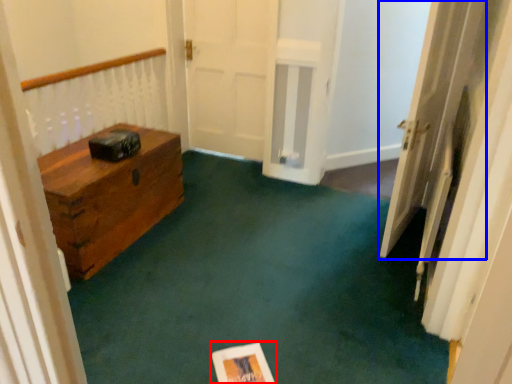
Question: Among these objects, which one is nearest to the camera, copy (highlighted by a red box) or door (highlighted by a blue box)?

Choices:
 (A) copy
 (B) door

Answer: (A)